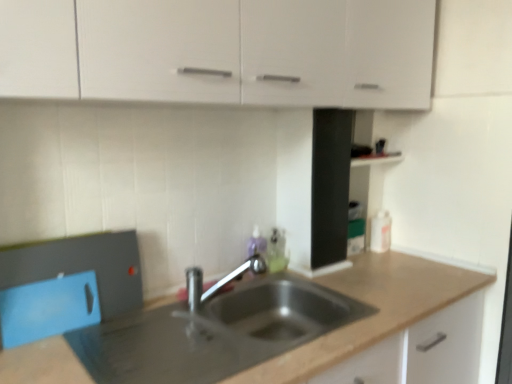
In order to click on blank space situated above metallic gray countertop at center (from a real-world perspective) in this screenshot , I will do `click(170, 344)`.